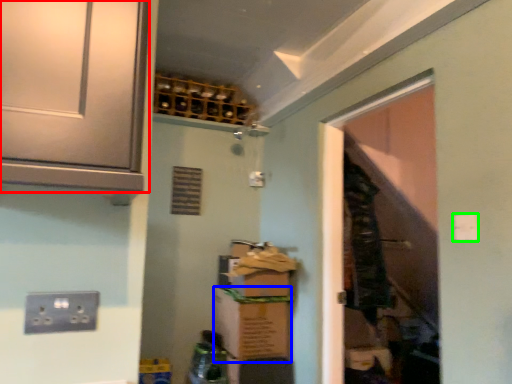
Question: Estimate the real-world distances between objects in this image. Which object is farther from cabinetry (highlighted by a red box), cardboard box (highlighted by a blue box) or light switch (highlighted by a green box)?

Choices:
 (A) cardboard box
 (B) light switch

Answer: (A)